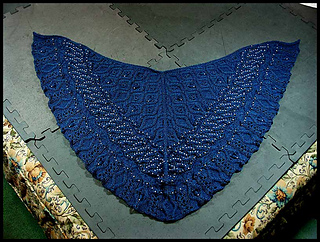
Locate an element on the screen. The width and height of the screenshot is (320, 242). towel is located at coordinates (196, 148).